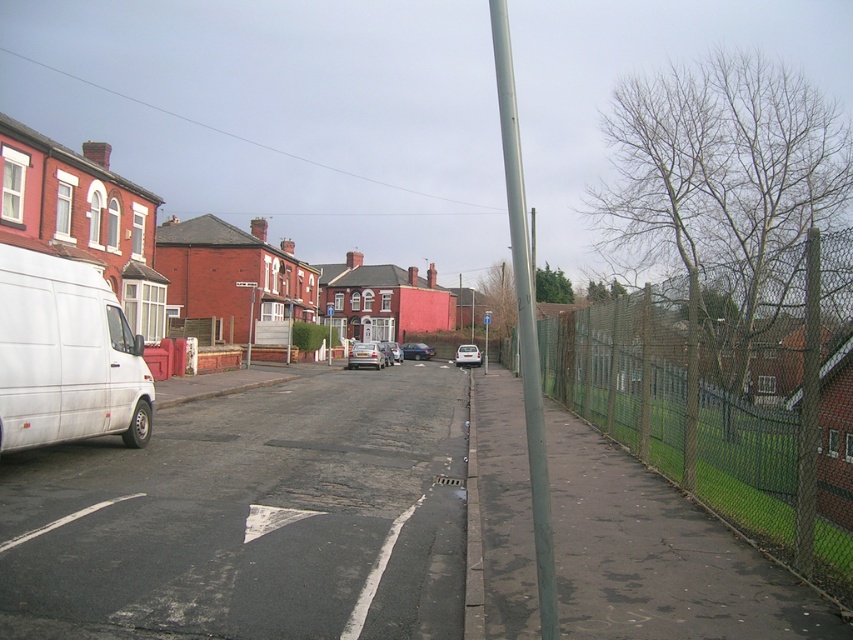
Between metallic gray pole at center-right and white plastic sign at center, which one appears on the left side from the viewer's perspective?

white plastic sign at center is more to the left.

Which is below, metallic gray pole at center-right or white plastic sign at center?

white plastic sign at center is lower down.

Where is `metallic gray pole at center-right`? metallic gray pole at center-right is located at coordinates (525, 323).

Does metallic gray pole at center-right appear on the left side of white matte car at center?

No, metallic gray pole at center-right is not to the left of white matte car at center.

Between point (550, 548) and point (457, 346), which one is positioned in front?

Point (550, 548)

Image resolution: width=853 pixels, height=640 pixels. Find the location of `metallic gray pole at center-right`. metallic gray pole at center-right is located at coordinates (525, 323).

Who is more distant from viewer, [62,289] or [485,365]?

The point [485,365] is behind.

Does point (123, 372) come behind point (485, 368)?

No, (123, 372) is in front of (485, 368).

Locate an element on the screen. Image resolution: width=853 pixels, height=640 pixels. white matte van at left is located at coordinates (67, 355).